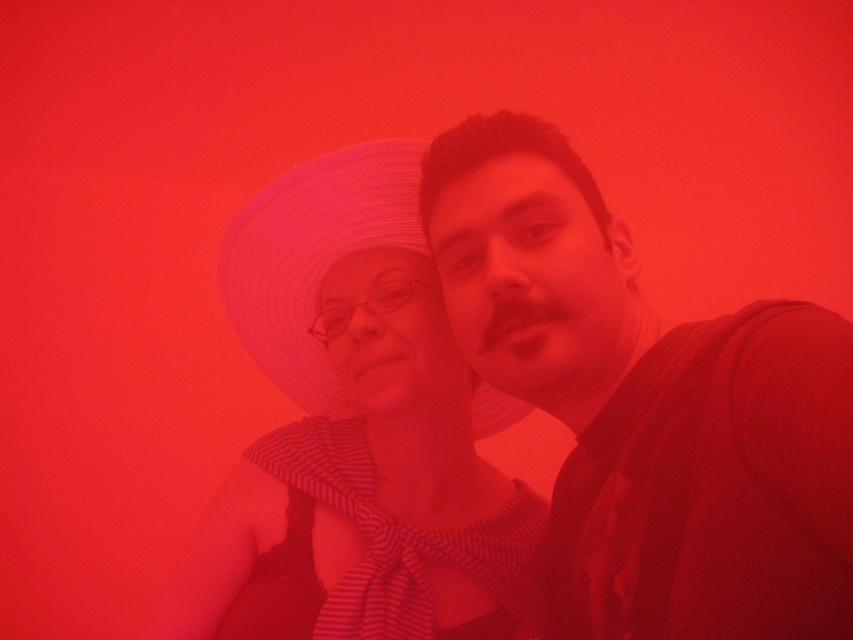
In the scene shown: You are a photographer trying to capture a closeup of the matte black shirt at center and the matte white hat at center. Which object should you focus on first to ensure both are in focus?

You should focus on the matte black shirt at center first because it is closer to the viewer than the matte white hat at center, allowing the camera to adjust focus starting from the nearest object.

You are designing a poster and need to ensure the matte black shirt at center and the matte white hat at center are visible. Given their sizes, which object should you place closer to the viewer to maintain visibility?

The matte black shirt at center has a larger size compared to the matte white hat at center, so placing the matte white hat at center closer to the viewer would help maintain visibility since it is smaller and needs to be emphasized.

You are an interior designer planning to place a small decorative item on a shelf between the matte white hat at center and the white straw hat at center. Which hat should you place the item closer to if you want it to balance the visual weight between both hats?

The matte white hat at center has a smaller size compared to white straw hat at center. To balance the visual weight, place the decorative item closer to the larger white straw hat at center so that the smaller and larger objects balance each other out.